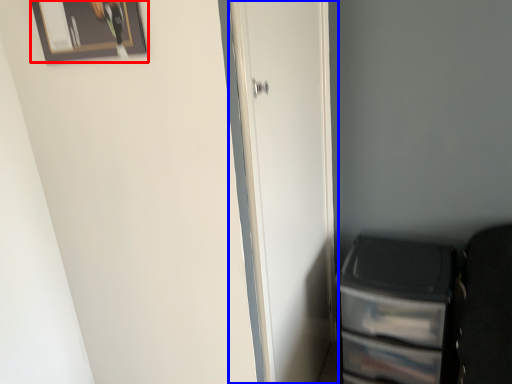
Question: Which object appears farthest to the camera in this image, picture frame (highlighted by a red box) or door (highlighted by a blue box)?

Choices:
 (A) picture frame
 (B) door

Answer: (B)